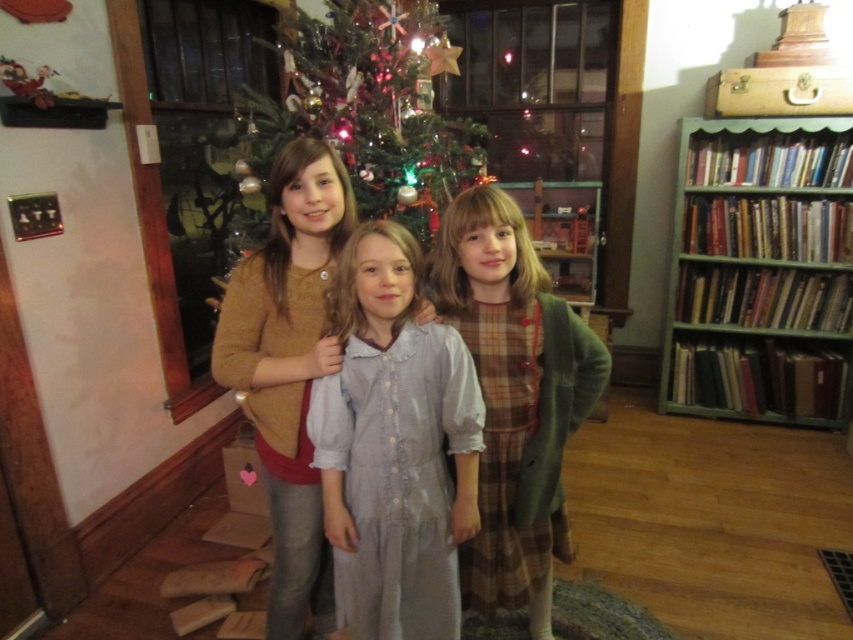
Question: Which object is the farthest from the plaid wool dress at center?

Choices:
 (A) green textured christmas tree at center
 (B) green painted wood bookshelf at right
 (C) light blue cotton dress at center

Answer: (B)

Question: Is green painted wood bookshelf at right to the left of green textured christmas tree at center from the viewer's perspective?

Choices:
 (A) no
 (B) yes

Answer: (A)

Question: Is light blue cotton dress at center smaller than green painted wood bookshelf at right?

Choices:
 (A) no
 (B) yes

Answer: (B)

Question: Based on their relative distances, which object is farther from the green painted wood bookshelf at right?

Choices:
 (A) light blue cotton dress at center
 (B) plaid wool dress at center
 (C) matte brown cardigan at center

Answer: (A)

Question: Estimate the real-world distances between objects in this image. Which object is farther from the green painted wood bookshelf at right?

Choices:
 (A) light blue cotton dress at center
 (B) green textured christmas tree at center
 (C) plaid wool dress at center

Answer: (A)

Question: In this image, where is light blue cotton dress at center located relative to plaid wool dress at center?

Choices:
 (A) above
 (B) below

Answer: (A)